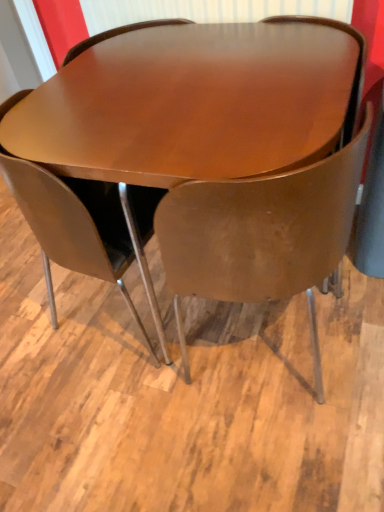
The height and width of the screenshot is (512, 384). Find the location of `vacant space that is to the left of matte brown chair at center, acting as the first chair starting from the left`. vacant space that is to the left of matte brown chair at center, acting as the first chair starting from the left is located at coordinates (38, 320).